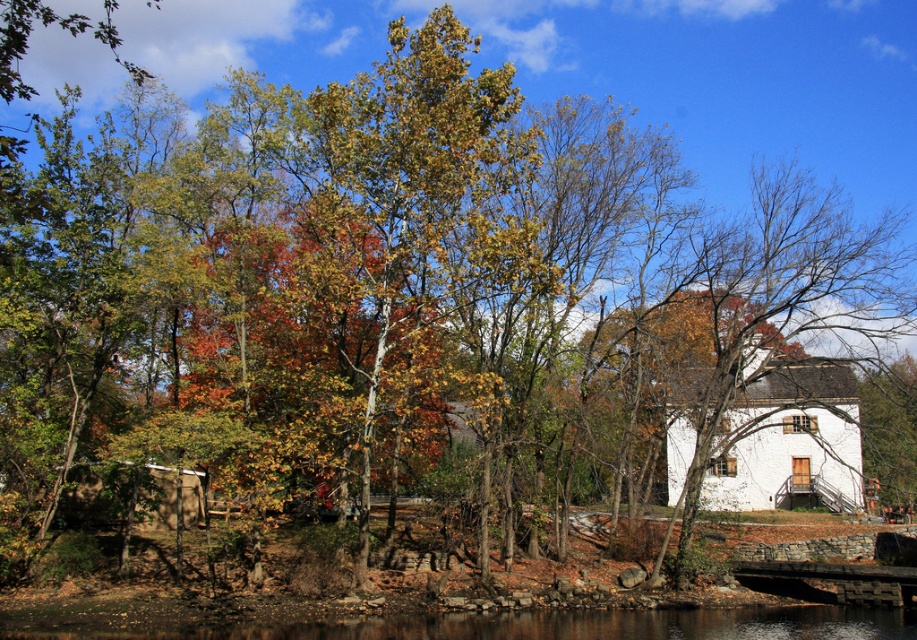
Which of these two, wooden cabin at lower left or stone bridge at lower right, stands taller?

wooden cabin at lower left

Locate an element on the screen. The width and height of the screenshot is (917, 640). wooden cabin at lower left is located at coordinates (86, 506).

Where is `wooden cabin at lower left`? Image resolution: width=917 pixels, height=640 pixels. wooden cabin at lower left is located at coordinates (86, 506).

Describe the element at coordinates (787, 440) in the screenshot. I see `white matte house at center-right` at that location.

Measure the distance between white matte house at center-right and wooden cabin at lower left.

white matte house at center-right is 31.88 meters from wooden cabin at lower left.

Locate an element on the screen. The image size is (917, 640). white matte house at center-right is located at coordinates (787, 440).

Does white matte house at center-right appear over stone bridge at lower right?

Yes, white matte house at center-right is above stone bridge at lower right.

The image size is (917, 640). I want to click on white matte house at center-right, so click(787, 440).

Which is in front, point (830, 401) or point (788, 573)?

Point (788, 573) is in front.

In order to click on white matte house at center-right in this screenshot , I will do `click(787, 440)`.